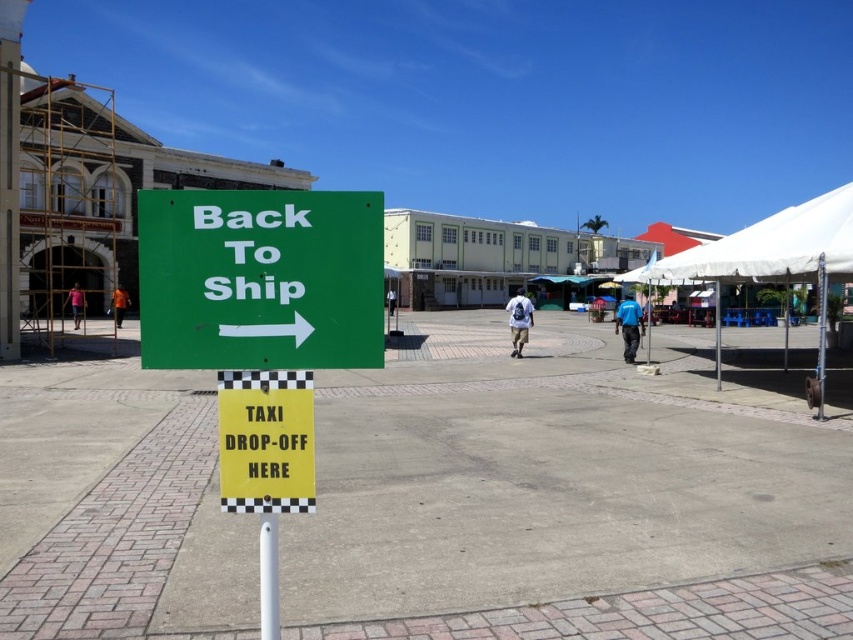
Who is higher up, white fabric canopy at upper right or white fabric backpack at center?

white fabric backpack at center is above.

Measure the distance between white fabric canopy at upper right and white fabric backpack at center.

They are 15.96 meters apart.

Describe the element at coordinates (775, 246) in the screenshot. I see `white fabric canopy at upper right` at that location.

Locate an element on the screen. This screenshot has height=640, width=853. white fabric canopy at upper right is located at coordinates (775, 246).

The height and width of the screenshot is (640, 853). What do you see at coordinates (260, 280) in the screenshot?
I see `green matte sign at center` at bounding box center [260, 280].

Is green matte sign at center further to the viewer compared to white fabric canopy at upper right?

No.

Who is more distant from viewer, (235, 348) or (711, 268)?

The point (711, 268) is behind.

Where is `green matte sign at center`? green matte sign at center is located at coordinates (260, 280).

Does yellow checkered taxi sign at lower center have a larger size compared to blue fabric shirt at center?

Actually, yellow checkered taxi sign at lower center might be smaller than blue fabric shirt at center.

Is yellow checkered taxi sign at lower center further to camera compared to blue fabric shirt at center?

No, yellow checkered taxi sign at lower center is closer to the viewer.

This screenshot has height=640, width=853. I want to click on yellow checkered taxi sign at lower center, so click(x=265, y=442).